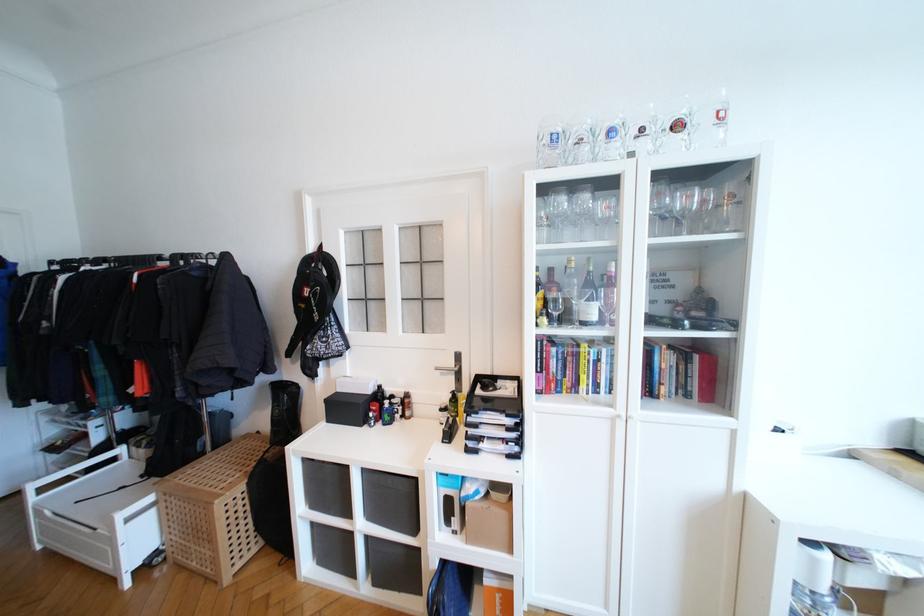
You are a GUI agent. You are given a task and a screenshot of the screen. Output one action in this format:
    pyautogui.click(x=<x>, y=<y>)
    Task: Click on the black storage box
    The width and height of the screenshot is (924, 616).
    Given the screenshot: What is the action you would take?
    pyautogui.click(x=347, y=408)